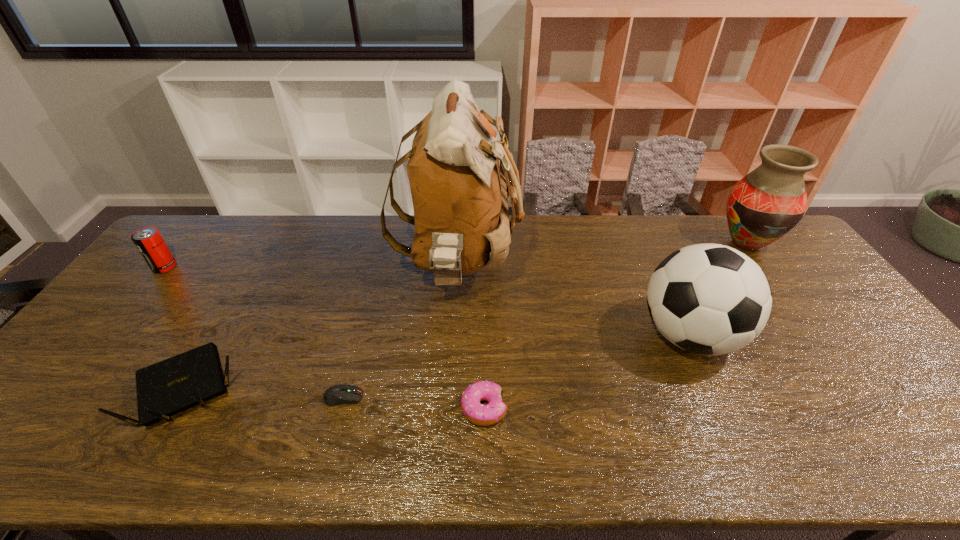
At what (x,y) coordinates should I click in order to perform the action: click on free space that is in between the doughnut and the tallest object. Please return your answer as a coordinate pair (x, y). This screenshot has width=960, height=540. Looking at the image, I should click on (471, 337).

At what (x,y) coordinates should I click in order to perform the action: click on free space that is in between the backpack and the soccer ball. Please return your answer as a coordinate pair (x, y). The image size is (960, 540). Looking at the image, I should click on (573, 301).

Image resolution: width=960 pixels, height=540 pixels. What are the coordinates of `free space between the router and the leftmost object` in the screenshot? It's located at (176, 327).

This screenshot has width=960, height=540. I want to click on free space between the doughnut and the computer equipment, so click(414, 403).

The width and height of the screenshot is (960, 540). What are the coordinates of `empty space that is in between the second object from left to right and the second object from right to left` in the screenshot? It's located at (438, 362).

Where is `vacant space that's between the fourth tallest object and the doughnut`? vacant space that's between the fourth tallest object and the doughnut is located at coordinates 324,338.

Identify the location of vacant point located between the fourth shortest object and the computer equipment. The height and width of the screenshot is (540, 960). (253, 332).

The image size is (960, 540). I want to click on vacant point located between the tallest object and the leftmost object, so coord(311,266).

Identify the location of free space between the tallest object and the soccer ball. (573, 301).

The width and height of the screenshot is (960, 540). What are the coordinates of `the closest object to the sixth tallest object` in the screenshot? It's located at (459, 195).